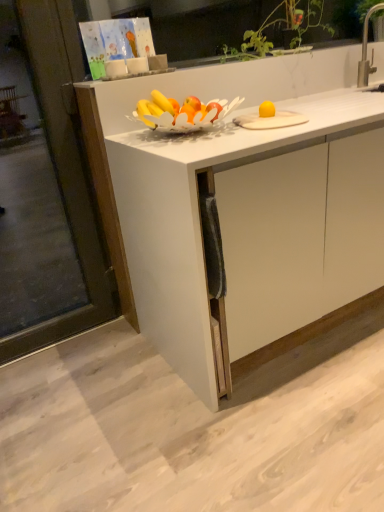
You are a GUI agent. You are given a task and a screenshot of the screen. Output one action in this format:
    pyautogui.click(x=<x>, y=<y>)
    Task: Click on the vacant space in front of transparent glass screen door at left
    The height and width of the screenshot is (512, 384).
    Given the screenshot: What is the action you would take?
    pyautogui.click(x=59, y=387)